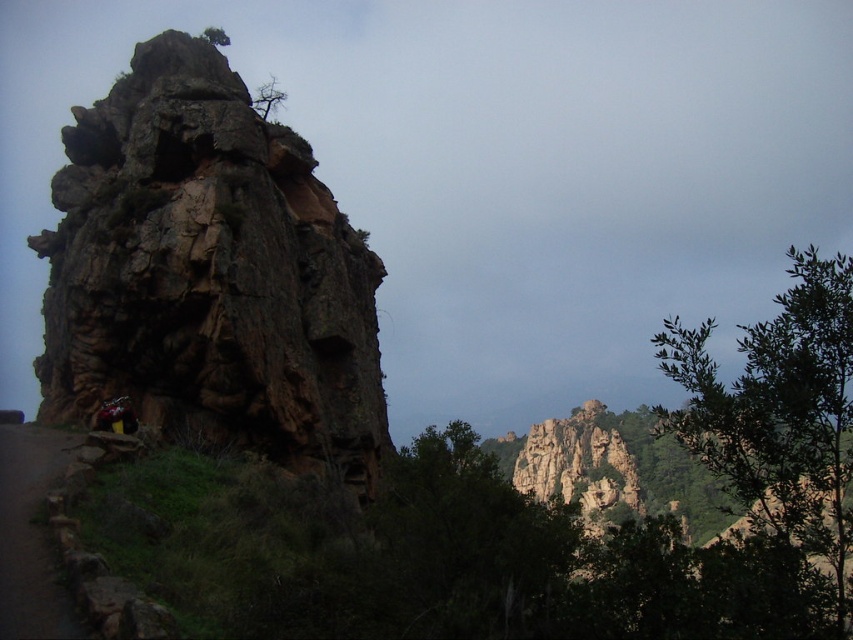
Does point (821, 508) lie in front of point (32, 561)?

That is False.

Between green leafy tree at right and dirt/gravel path at lower left, which one is positioned lower?

Positioned lower is dirt/gravel path at lower left.

Is point (689, 451) positioned in front of point (21, 474)?

No, (689, 451) is further to viewer.

You are a GUI agent. You are given a task and a screenshot of the screen. Output one action in this format:
    pyautogui.click(x=<x>, y=<y>)
    Task: Click on the green leafy tree at right
    
    Given the screenshot: What is the action you would take?
    pyautogui.click(x=779, y=413)

Does green leafy tree at right have a lesser height compared to green leafy tree at center?

Incorrect, green leafy tree at right's height does not fall short of green leafy tree at center's.

Does green leafy tree at right appear under green leafy tree at center?

Incorrect, green leafy tree at right is not positioned below green leafy tree at center.

Is point (843, 531) less distant than point (491, 522)?

That is True.

The height and width of the screenshot is (640, 853). Identify the location of green leafy tree at right. (779, 413).

Between dirt/gravel path at lower left and bare branches at upper center, which one has less height?

dirt/gravel path at lower left

From the picture: Can you confirm if dirt/gravel path at lower left is shorter than bare branches at upper center?

Yes, dirt/gravel path at lower left is shorter than bare branches at upper center.

What do you see at coordinates (30, 536) in the screenshot?
I see `dirt/gravel path at lower left` at bounding box center [30, 536].

I want to click on dirt/gravel path at lower left, so [30, 536].